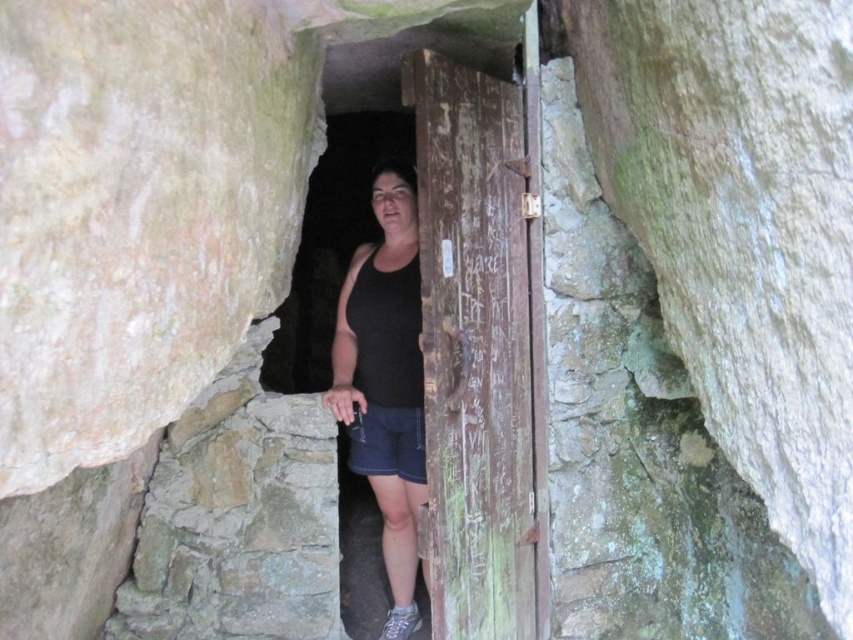
Is weathered wood door at center behind denim shorts at center?

No, it is not.

Does point (339, 26) lie behind point (364, 445)?

No, (339, 26) is closer to viewer.

This screenshot has width=853, height=640. Find the location of `weathered wood door at center`. weathered wood door at center is located at coordinates (402, 44).

Which is below, black matte tank top at center or weathered wood door at center?

black matte tank top at center is below.

Is black matte tank top at center above weathered wood door at center?

Incorrect, black matte tank top at center is not positioned above weathered wood door at center.

Between point (387, 282) and point (490, 51), which one is positioned behind?

Positioned behind is point (387, 282).

What are the coordinates of `black matte tank top at center` in the screenshot? It's located at (386, 381).

Is black matte tank top at center smaller than denim shorts at center?

Actually, black matte tank top at center might be larger than denim shorts at center.

In the scene shown: Does black matte tank top at center appear on the right side of denim shorts at center?

Correct, you'll find black matte tank top at center to the right of denim shorts at center.

Which is in front, point (389, 381) or point (367, 438)?

Point (389, 381) is in front.

You are a GUI agent. You are given a task and a screenshot of the screen. Output one action in this format:
    pyautogui.click(x=<x>, y=<y>)
    Task: Click on the black matte tank top at center
    Image resolution: width=853 pixels, height=640 pixels.
    Given the screenshot: What is the action you would take?
    pyautogui.click(x=386, y=381)